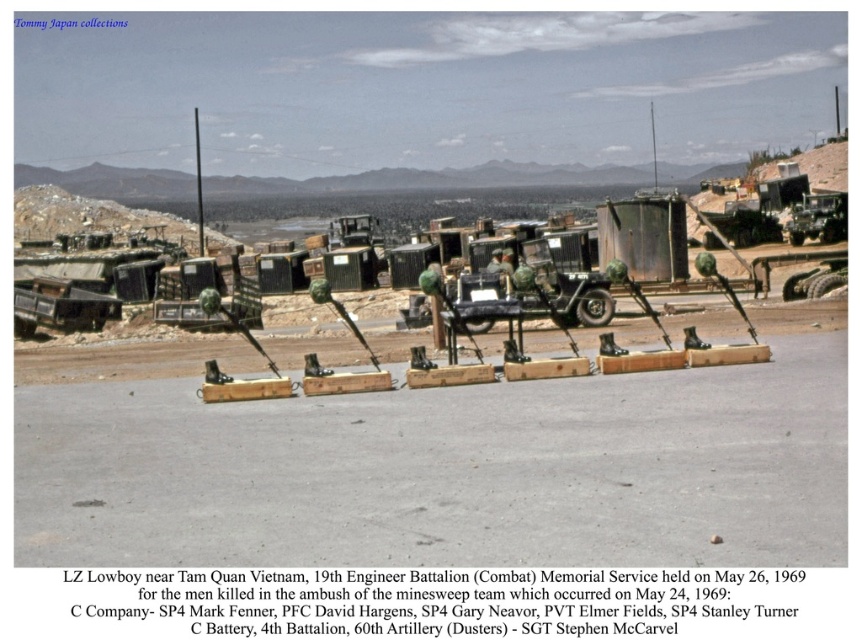
Based on the photo, you are a photographer standing at the memorial setup near Tam Quan, Vietnam. You want to take a photo of the matte black truck at left. Where should you position yourself to capture it in the frame?

You should position yourself at point (x=60, y=307) to capture the matte black truck at left in the frame.

You are a photographer positioned at the memorial setup near Tam Quan, Vietnam. You want to capture a photo that includes both the matte black truck at left and the matte green military vehicle at right. Which vehicle should you position closer to the camera to ensure both are in focus?

You should position the matte black truck at left closer to the camera since it is already nearer to the viewer than the matte green military vehicle at right, ensuring both will be in focus when properly framed.

You are a historian visiting the memorial site. You notice two points marked on a map of the memorial area. The first point is at coordinates point (52, 326) and the second is at point (845, 228). Based on the memorial setup described, which point is closer to the military vehicles?

Point (52, 326) is in front of point (845, 228), so it is closer to the military vehicles.